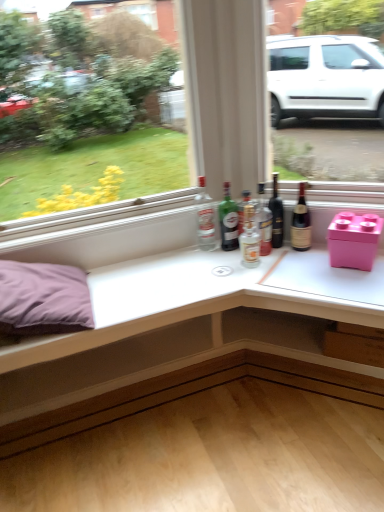
At what (x,y) coordinates should I click in order to perform the action: click on vacant area that is in front of brown glass bottle at right, arranged as the fifth bottle when viewed from the left. Please return your answer as a coordinate pair (x, y). Looking at the image, I should click on (306, 264).